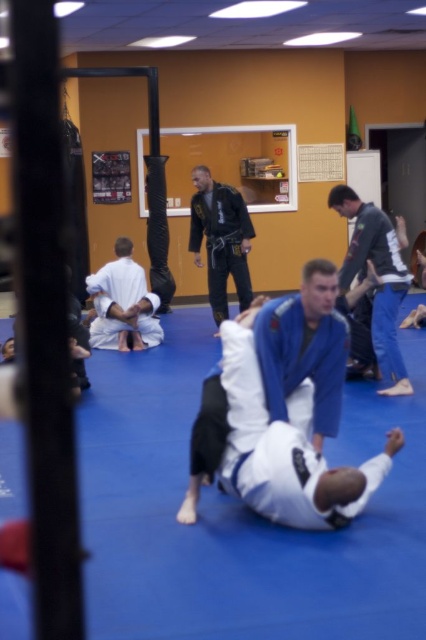
Question: Is blue fabric gi at center to the left of white matte kimono at center from the viewer's perspective?

Choices:
 (A) yes
 (B) no

Answer: (B)

Question: Which object appears farthest from the camera in this image?

Choices:
 (A) blue fabric gi at center
 (B) blue matte kimono at center
 (C) black matte gi at center

Answer: (C)

Question: Does black matte gi at center appear on the left side of white matte kimono at center?

Choices:
 (A) no
 (B) yes

Answer: (A)

Question: Is blue matte kimono at center below white matte kimono at center?

Choices:
 (A) yes
 (B) no

Answer: (A)

Question: Among these points, which one is nearest to the camera?

Choices:
 (A) (302, 282)
 (B) (383, 394)
 (C) (123, 266)
 (D) (210, 221)

Answer: (A)

Question: Which object appears farthest from the camera in this image?

Choices:
 (A) blue fabric gi at center
 (B) black matte gi at center
 (C) blue matte kimono at center

Answer: (B)